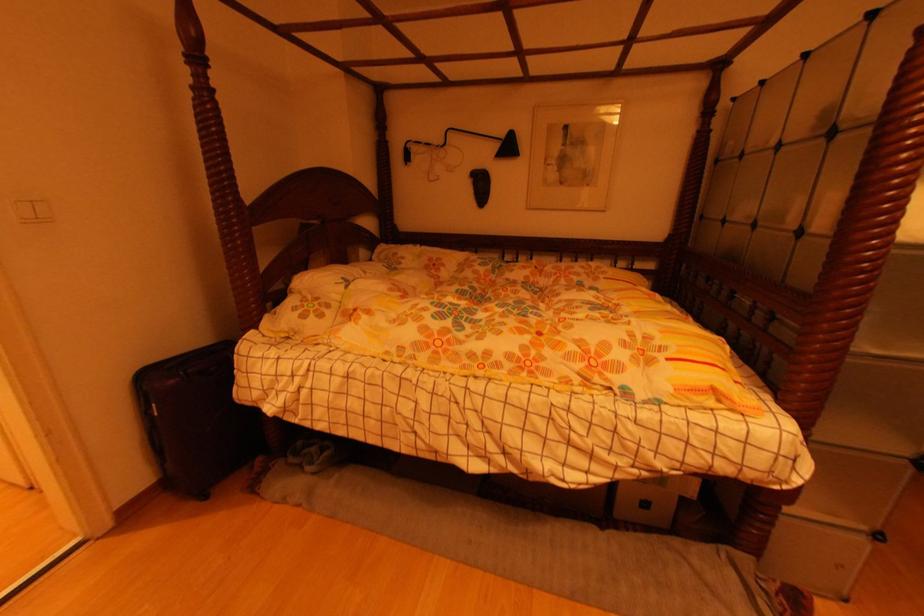
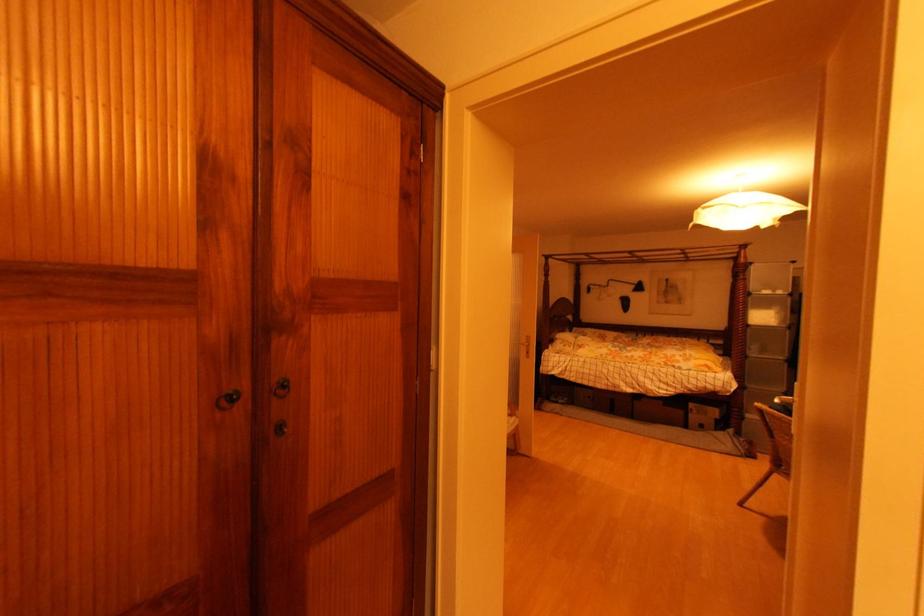
Where in the second image is the point corresponding to (x=501, y=148) from the first image?

(638, 288)